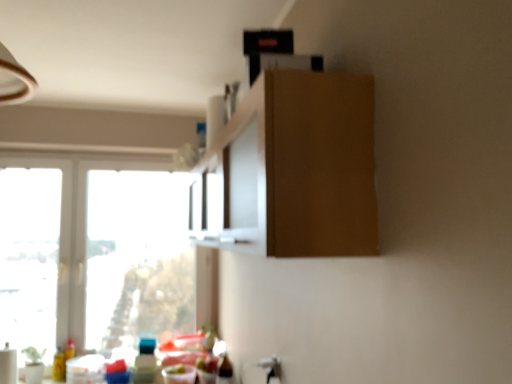
Question: Considering the relative sizes of white glossy window at lower left and translucent plastic bottle at lower left in the image provided, is white glossy window at lower left wider than translucent plastic bottle at lower left?

Choices:
 (A) yes
 (B) no

Answer: (B)

Question: Does white glossy window at lower left have a smaller size compared to translucent plastic bottle at lower left?

Choices:
 (A) no
 (B) yes

Answer: (A)

Question: Can you confirm if white glossy window at lower left is positioned to the right of translucent plastic bottle at lower left?

Choices:
 (A) no
 (B) yes

Answer: (A)

Question: Is the depth of white glossy window at lower left greater than that of translucent plastic bottle at lower left?

Choices:
 (A) yes
 (B) no

Answer: (A)

Question: Is white glossy window at lower left positioned in front of translucent plastic bottle at lower left?

Choices:
 (A) no
 (B) yes

Answer: (A)

Question: Considering their positions, is matte wood cabinet at upper center located in front of or behind white glossy window at lower left?

Choices:
 (A) front
 (B) behind

Answer: (A)

Question: Would you say matte wood cabinet at upper center is inside or outside white glossy window at lower left?

Choices:
 (A) outside
 (B) inside

Answer: (A)

Question: Is point (337, 148) positioned closer to the camera than point (132, 337)?

Choices:
 (A) closer
 (B) farther

Answer: (A)

Question: In terms of size, does matte wood cabinet at upper center appear bigger or smaller than white glossy window at lower left?

Choices:
 (A) small
 (B) big

Answer: (B)

Question: From a real-world perspective, is matte wood cabinet at upper center positioned above or below translucent plastic bottle at lower left?

Choices:
 (A) below
 (B) above

Answer: (B)

Question: Is matte wood cabinet at upper center in front of or behind translucent plastic bottle at lower left in the image?

Choices:
 (A) behind
 (B) front

Answer: (B)

Question: From the image's perspective, is matte wood cabinet at upper center located above or below translucent plastic bottle at lower left?

Choices:
 (A) below
 (B) above

Answer: (B)

Question: Considering the positions of matte wood cabinet at upper center and translucent plastic bottle at lower left in the image, is matte wood cabinet at upper center bigger or smaller than translucent plastic bottle at lower left?

Choices:
 (A) big
 (B) small

Answer: (A)

Question: Looking at their shapes, would you say translucent plastic bottle at lower left is wider or thinner than white glossy window at lower left?

Choices:
 (A) wide
 (B) thin

Answer: (A)

Question: From their relative heights in the image, would you say translucent plastic bottle at lower left is taller or shorter than white glossy window at lower left?

Choices:
 (A) tall
 (B) short

Answer: (B)